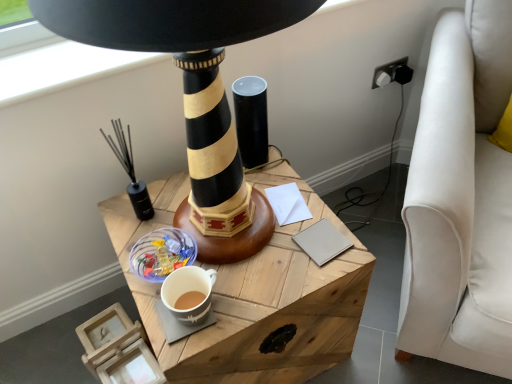
The width and height of the screenshot is (512, 384). I want to click on vacant region to the right of matte ceramic mug at lower center, so click(x=266, y=284).